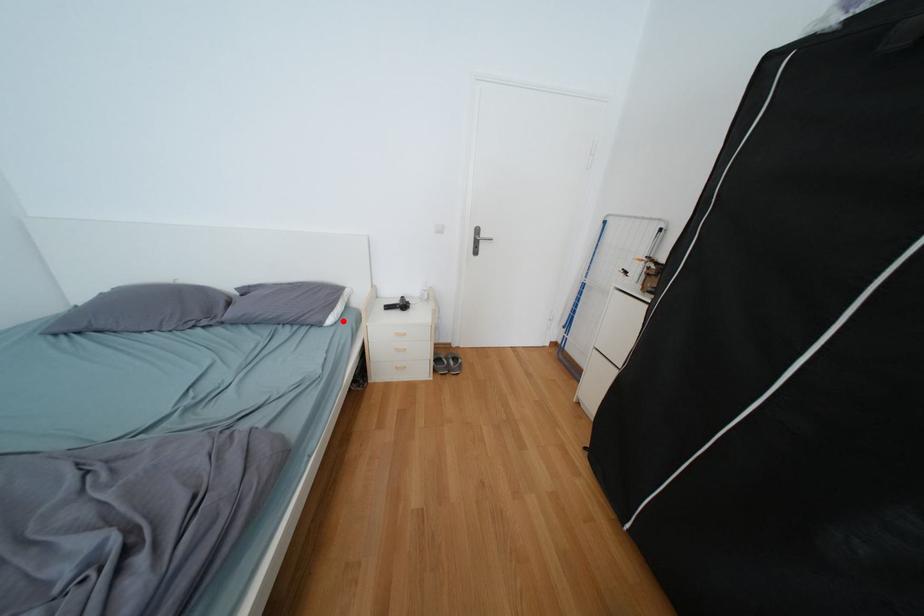
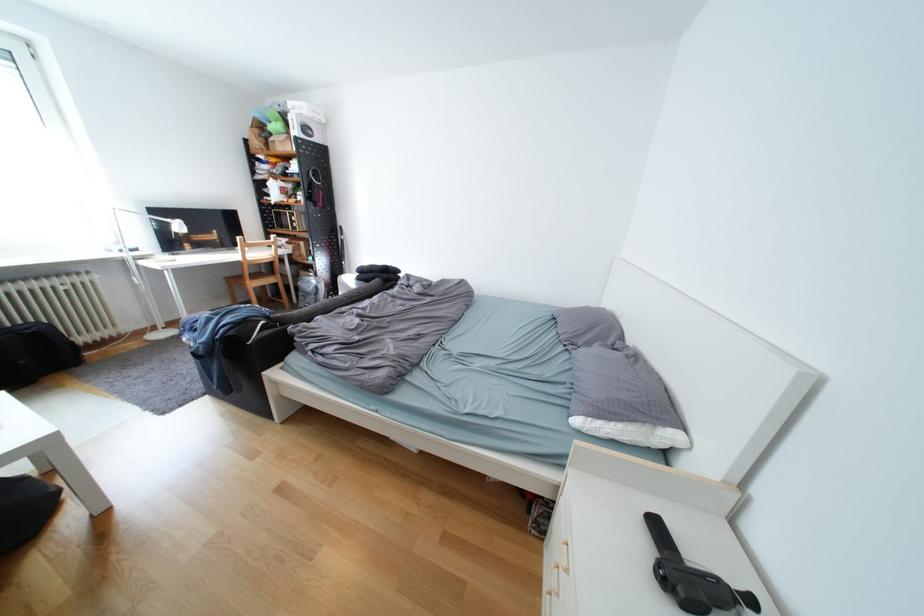
Question: A red point is marked in image1. In image2, is the corresponding 3D point closer to the camera or farther? Reply with the corresponding letter.

Choices:
 (A) The corresponding 3D point is closer.
 (B) The corresponding 3D point is farther.

Answer: (B)